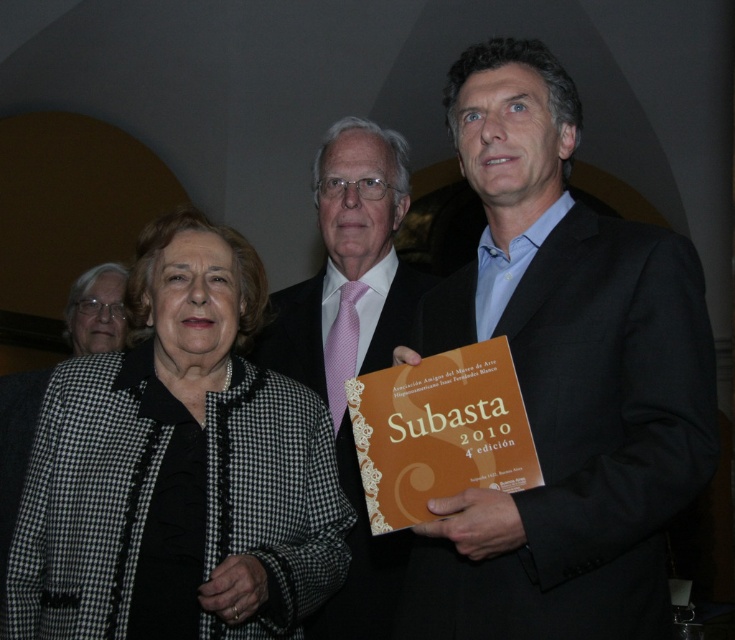
You are planning to place a new object between the black suit at right and the orange matte book at center. Considering their sizes, which one should you place closer to the center to ensure there is enough space?

The black suit at right might be wider than the orange matte book at center, so placing the narrower orange matte book at center closer to the center would leave more space for the wider black suit at right.